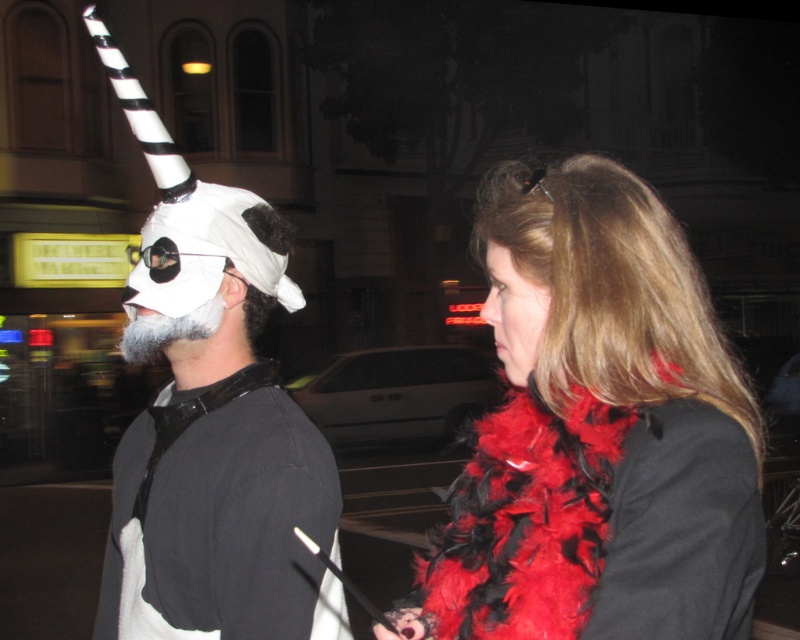
Question: Does feather boa at right appear under smooth red scarf at right?

Choices:
 (A) no
 (B) yes

Answer: (B)

Question: Which point is farther from the camera taking this photo?

Choices:
 (A) (588, 602)
 (B) (184, 497)
 (C) (500, 280)

Answer: (B)

Question: Does white matte mask at left lie behind smooth red scarf at right?

Choices:
 (A) no
 (B) yes

Answer: (B)

Question: Does white matte mask at left come behind smooth red scarf at right?

Choices:
 (A) yes
 (B) no

Answer: (A)

Question: Among these objects, which one is farthest from the camera?

Choices:
 (A) white matte mask at left
 (B) smooth red scarf at right

Answer: (A)

Question: Which object is closer to the camera taking this photo?

Choices:
 (A) white matte mask at left
 (B) feather boa at right
 (C) smooth red scarf at right

Answer: (B)